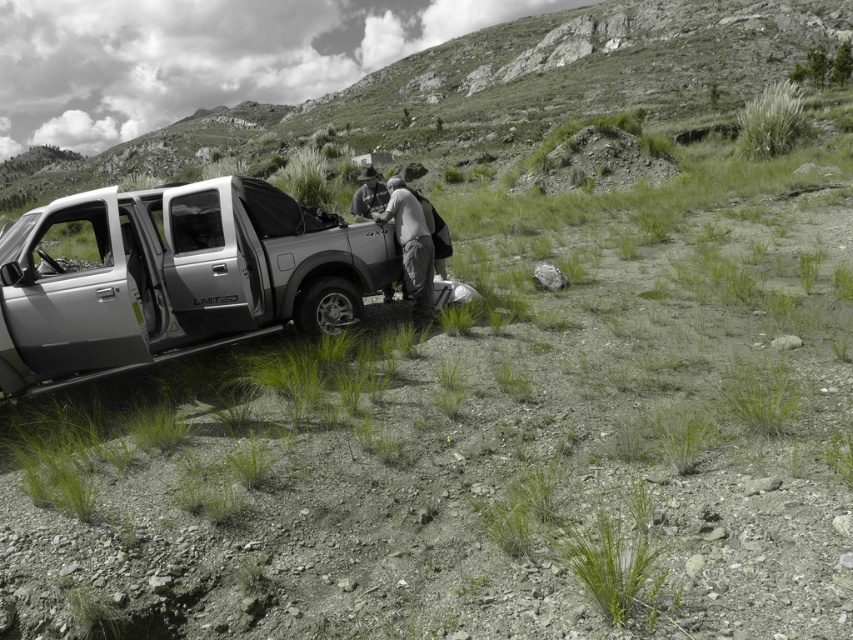
You are a photographer positioned at the center of the scene. You want to take a photo of the satin silver truck at left and the gray fabric jacket at center. Based on their positions, which object is closer to your current position?

The gray fabric jacket at center is closer to your current position because it is at the center, while the satin silver truck at left is positioned to the left of it.

You are a photographer setting up a tripod to capture the satin silver truck at left and the gray fabric jacket at center. Given that the jacket is closer to the camera, which object will appear larger in the photo?

The gray fabric jacket at center will appear larger in the photo because it is closer to the camera, even though the satin silver truck at left is actually larger in size.